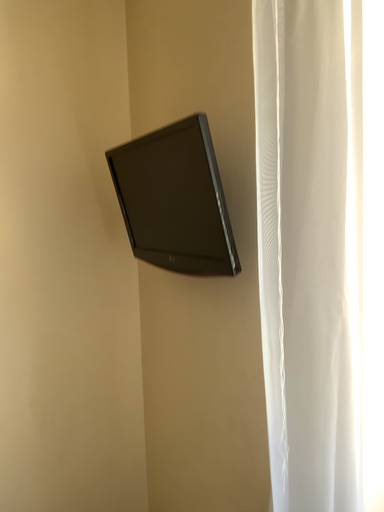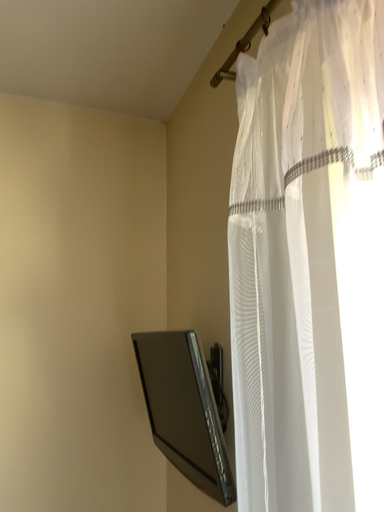
Question: Which way did the camera rotate in the video?

Choices:
 (A) rotated left
 (B) rotated right

Answer: (A)